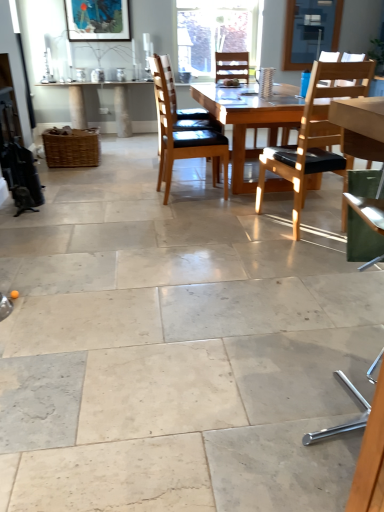
Question: Is light brown wood chair at center right, which is the first chair in right-to-left order, positioned with its back to transparent glass window screen at upper center?

Choices:
 (A) yes
 (B) no

Answer: (B)

Question: Can you confirm if light brown wood chair at center right, which is the first chair in right-to-left order, is bigger than transparent glass window screen at upper center?

Choices:
 (A) yes
 (B) no

Answer: (A)

Question: Is light brown wood chair at center right, the second chair positioned from the back, not near transparent glass window screen at upper center?

Choices:
 (A) yes
 (B) no

Answer: (A)

Question: Does light brown wood chair at center right, the second chair positioned from the back, appear on the right side of transparent glass window screen at upper center?

Choices:
 (A) yes
 (B) no

Answer: (B)

Question: From the image's perspective, is light brown wood chair at center right, which is the first chair in right-to-left order, under transparent glass window screen at upper center?

Choices:
 (A) no
 (B) yes

Answer: (B)

Question: Considering the relative positions of light brown wood chair at center right, the second chair positioned from the back, and transparent glass window screen at upper center in the image provided, is light brown wood chair at center right, the second chair positioned from the back, in front of transparent glass window screen at upper center?

Choices:
 (A) no
 (B) yes

Answer: (B)

Question: Can you confirm if light brown wood chair at center right, positioned as the second chair in front-to-back order, is positioned to the left of wooden table at center?

Choices:
 (A) yes
 (B) no

Answer: (B)

Question: From a real-world perspective, is light brown wood chair at center right, the second chair positioned from the back, physically below wooden table at center?

Choices:
 (A) no
 (B) yes

Answer: (A)

Question: Could you tell me if light brown wood chair at center right, the second chair positioned from the back, is facing wooden table at center?

Choices:
 (A) no
 (B) yes

Answer: (B)

Question: Is light brown wood chair at center right, positioned as the second chair in front-to-back order, outside of wooden table at center?

Choices:
 (A) no
 (B) yes

Answer: (B)

Question: Is light brown wood chair at center right, the second chair positioned from the back, bigger than wooden table at center?

Choices:
 (A) no
 (B) yes

Answer: (A)

Question: Is light brown wood chair at center right, positioned as the second chair in front-to-back order, wider than wooden table at center?

Choices:
 (A) no
 (B) yes

Answer: (A)

Question: Is transparent glass window screen at upper center taller than matte wooden picture frame at upper center?

Choices:
 (A) no
 (B) yes

Answer: (B)